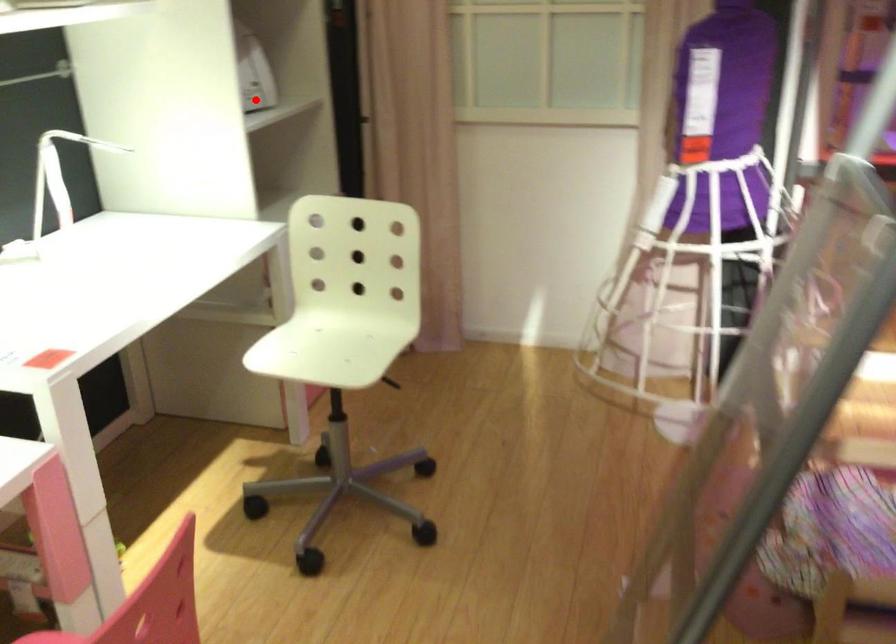
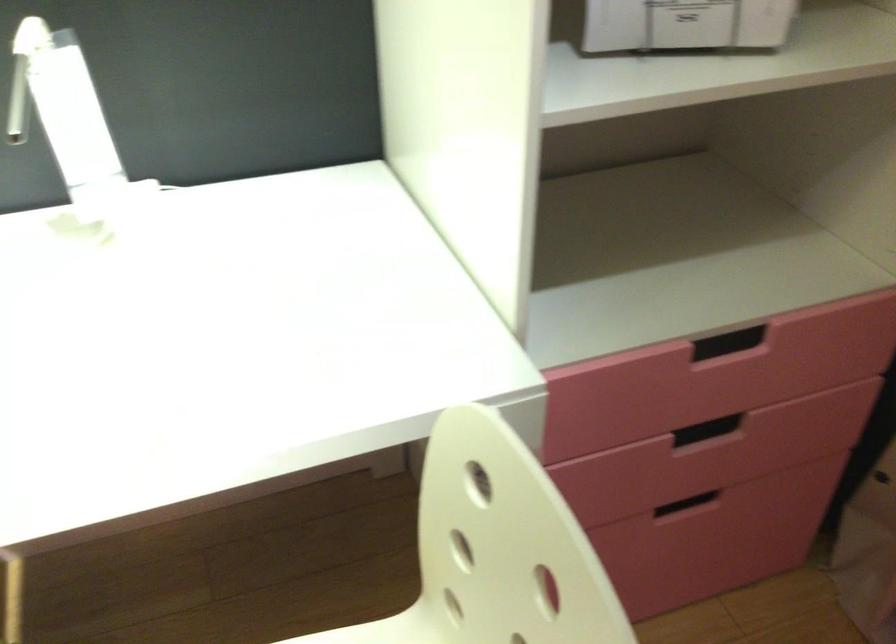
Where in the second image is the point corresponding to the highlighted location from the first image?

(685, 24)